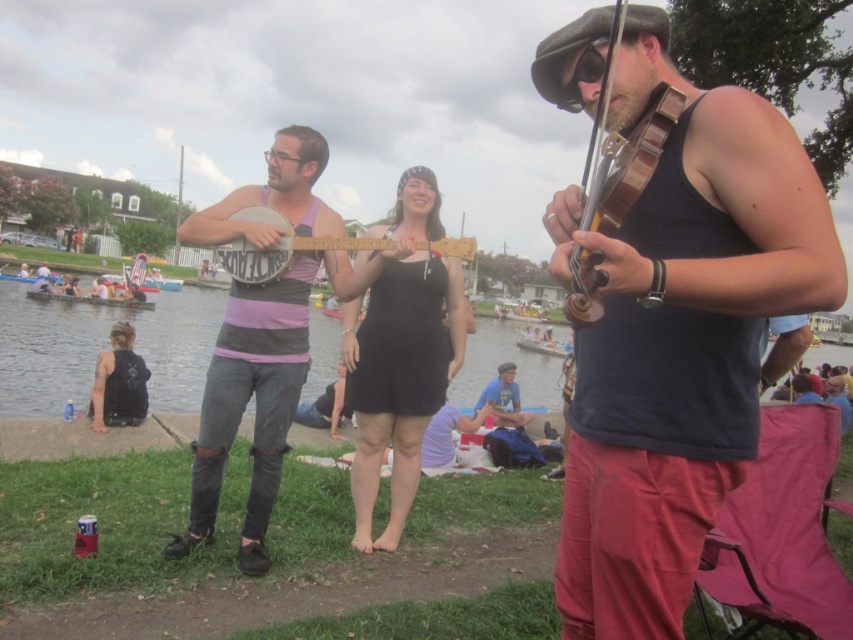
Measure the distance from matte black tank top at center to purple matte tank top at center.

matte black tank top at center and purple matte tank top at center are 2.74 meters apart.

Between matte black tank top at center and purple matte tank top at center, which one has more height?

purple matte tank top at center is taller.

Is point (666, 628) positioned before point (299, 141)?

Yes, point (666, 628) is closer to viewer.

At what (x,y) coordinates should I click in order to perform the action: click on matte black tank top at center. Please return your answer as a coordinate pair (x, y). Looking at the image, I should click on (677, 339).

Which of these two, black fabric dress at center or blue t-shirt at center, stands taller?

black fabric dress at center

Based on the photo, is black fabric dress at center to the right of blue t-shirt at center from the viewer's perspective?

No, black fabric dress at center is not to the right of blue t-shirt at center.

Who is more forward, (415,352) or (485,397)?

Point (415,352)

Where is `black fabric dress at center`? The image size is (853, 640). black fabric dress at center is located at coordinates (399, 378).

Describe the element at coordinates (100, 348) in the screenshot. I see `clear water at lower left` at that location.

Can you confirm if clear water at lower left is wider than wooden violin at right?

Indeed, clear water at lower left has a greater width compared to wooden violin at right.

Between point (184, 403) and point (624, 177), which one is positioned behind?

The point (184, 403) is more distant.

Image resolution: width=853 pixels, height=640 pixels. In order to click on clear water at lower left in this screenshot , I will do `click(100, 348)`.